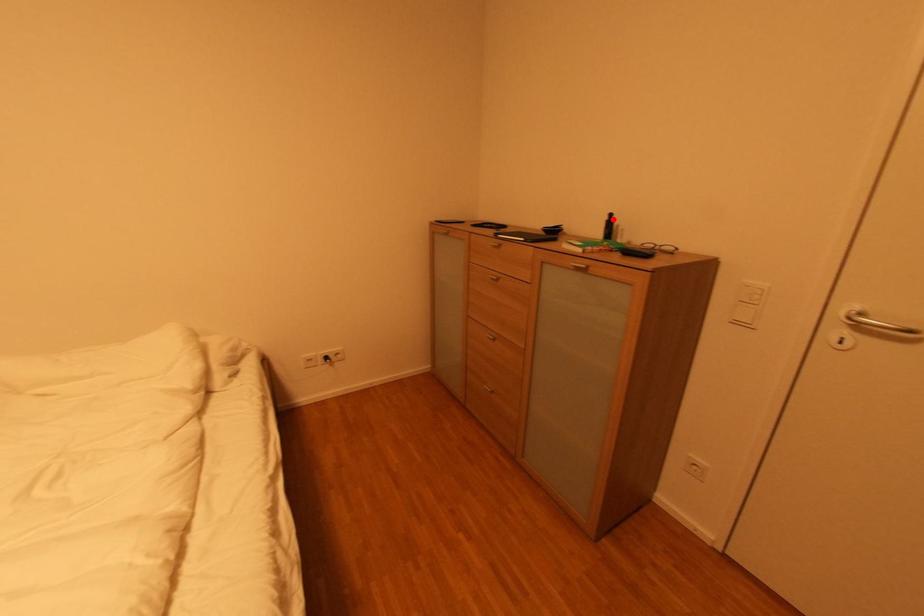
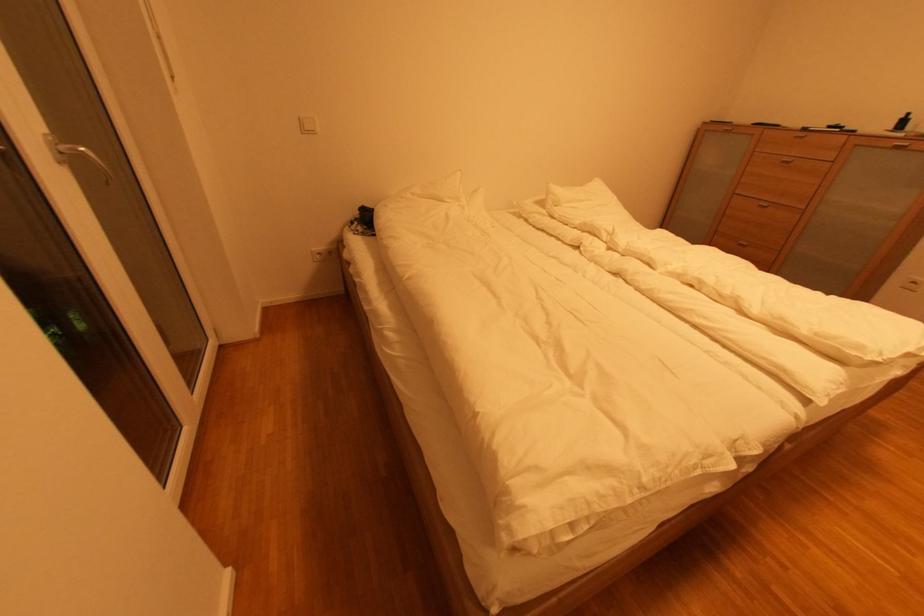
Locate, in the second image, the point that corresponds to the highlighted location in the first image.

(908, 118)